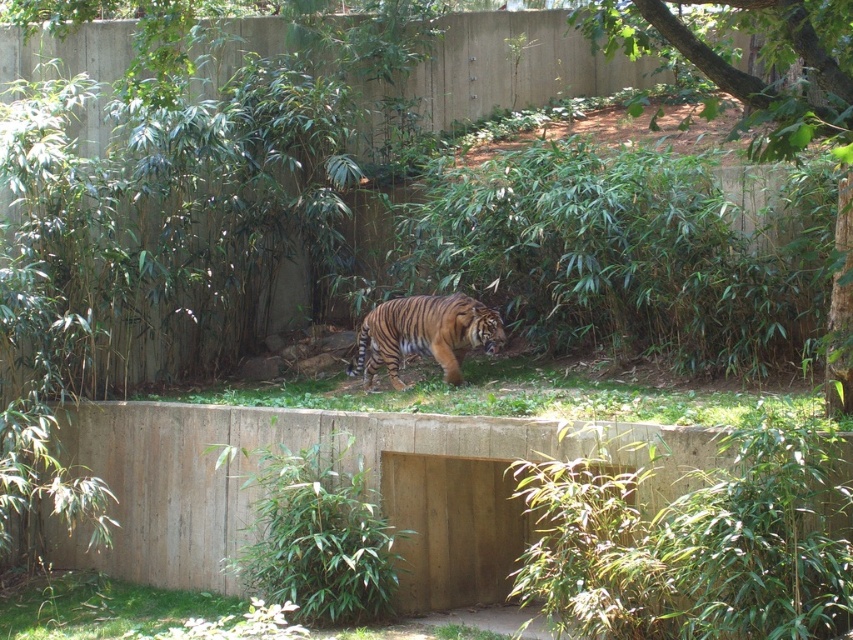
Based on the photo, you are a zookeeper planning to place a new feeding station in the enclosure. The feeding station requires a space wider than the orange striped tiger at center. Can the concrete at center accommodate this requirement?

The concrete at center has a width larger than the orange striped tiger at center, so it can accommodate the feeding station requiring a space wider than the tiger.